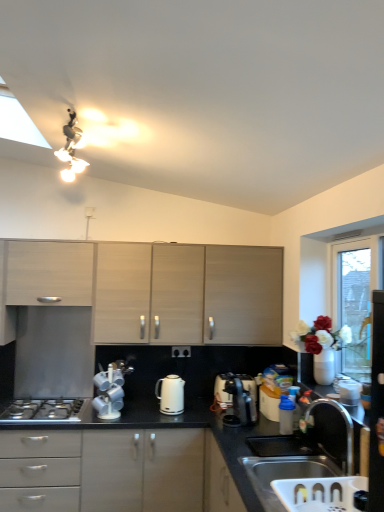
Locate an element on the screen. free location above silver metallic gas stove at lower left (from a real-world perspective) is located at coordinates (38, 406).